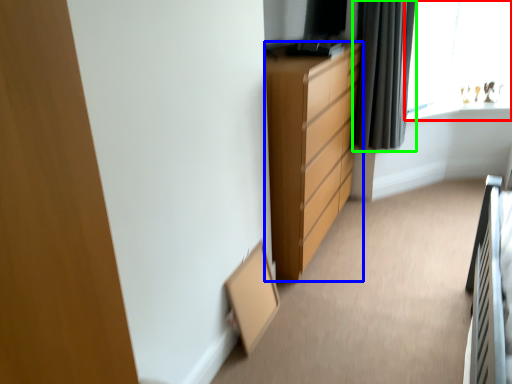
Question: Which object is positioned farthest from window (highlighted by a red box)? Select from chest of drawers (highlighted by a blue box) and curtain (highlighted by a green box).

Choices:
 (A) chest of drawers
 (B) curtain

Answer: (A)